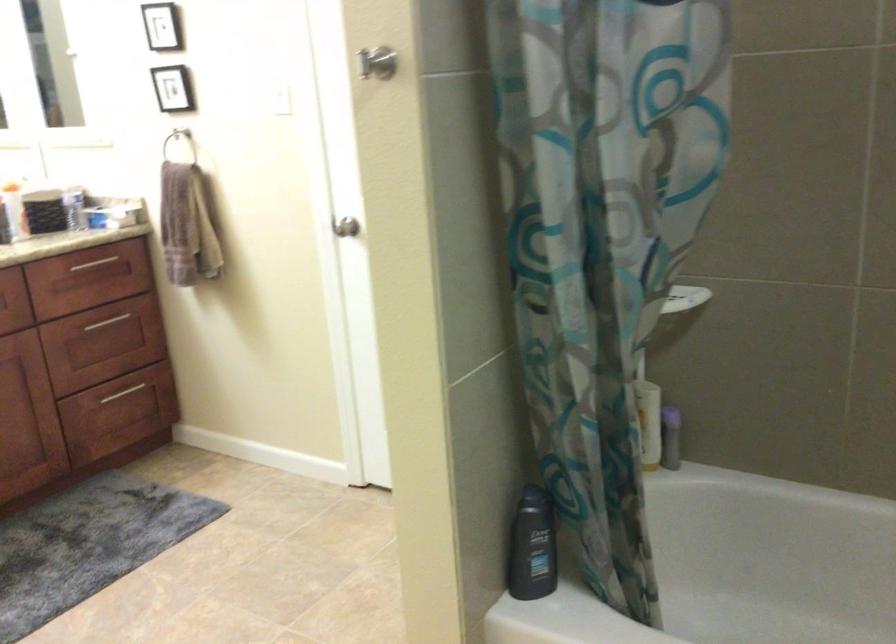
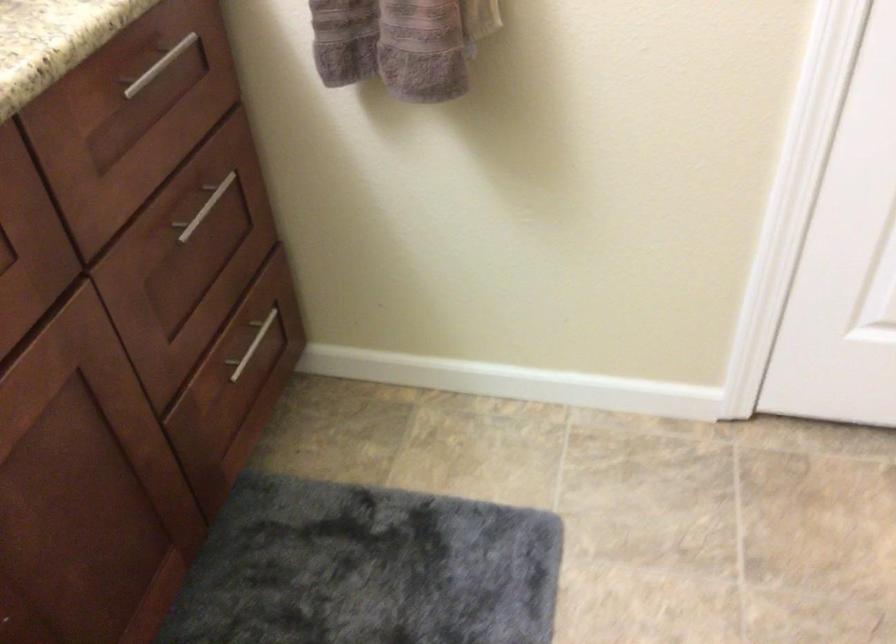
Locate, in the second image, the point that corresponds to [112,317] in the first image.

(203, 207)